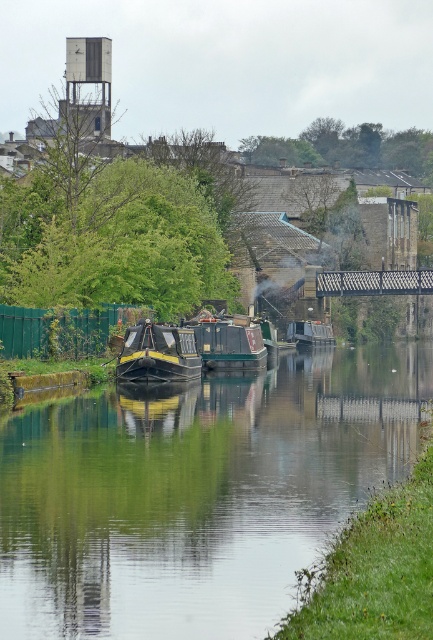
Which is in front, point (19, 465) or point (171, 346)?

Point (19, 465) is more forward.

This screenshot has height=640, width=433. Describe the element at coordinates (197, 492) in the screenshot. I see `green glossy water at center` at that location.

Locate an element on the screen. The width and height of the screenshot is (433, 640). green glossy water at center is located at coordinates (197, 492).

Who is more distant from viewer, (200,348) or (330,337)?

The point (330,337) is behind.

Which is behind, point (233, 353) or point (319, 324)?

Point (319, 324)

Image resolution: width=433 pixels, height=640 pixels. I want to click on green wooden boat at center, so click(x=229, y=342).

Is green wooden boat at center closer to camera compared to metallic grid bridge at center?

That is True.

Is green wooden boat at center taller than metallic grid bridge at center?

Correct, green wooden boat at center is much taller as metallic grid bridge at center.

I want to click on green wooden boat at center, so click(229, 342).

Image resolution: width=433 pixels, height=640 pixels. I want to click on green wooden boat at center, so click(x=229, y=342).